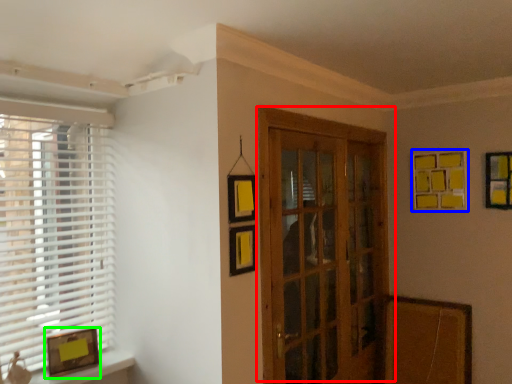
Question: Which object is positioned farthest from door (highlighted by a red box)? Select from picture frame (highlighted by a blue box) and picture frame (highlighted by a green box).

Choices:
 (A) picture frame
 (B) picture frame

Answer: (B)